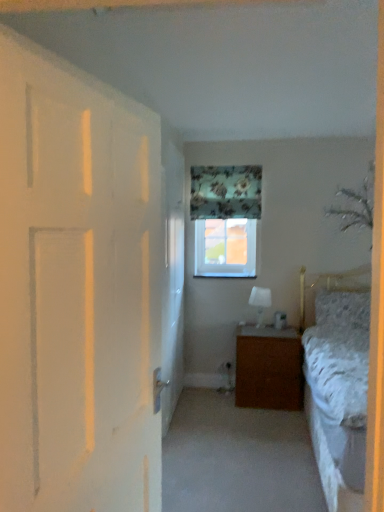
Measure the distance between floral fabric curtain at upper center and camera.

They are 3.98 meters apart.

Describe the element at coordinates (260, 302) in the screenshot. The image size is (384, 512). I see `white glossy lampshade at center` at that location.

What is the approximate width of white matte door at left?

white matte door at left is 5.54 inches in width.

What is the approximate height of white matte door at left?

The height of white matte door at left is 4.85 feet.

What is the approximate height of brown wooden nightstand at center?

It is 65.44 centimeters.

Where is `white glossy screen door at center`? white glossy screen door at center is located at coordinates coord(172,278).

At what (x,y) coordinates should I click in order to perform the action: click on fluffy white pillow at right. Please return your answer as a coordinate pair (x, y). Looking at the image, I should click on (343, 308).

Locate an element on the screen. Image resolution: width=384 pixels, height=512 pixels. floral fabric curtain at upper center is located at coordinates (225, 192).

In terms of width, does brown wooden nightstand at center look wider or thinner when compared to floral fabric curtain at upper center?

Considering their sizes, brown wooden nightstand at center looks broader than floral fabric curtain at upper center.

Is floral fabric curtain at upper center surrounded by brown wooden nightstand at center?

Definitely not — floral fabric curtain at upper center is not inside brown wooden nightstand at center.

How many degrees apart are the facing directions of brown wooden nightstand at center and floral fabric curtain at upper center?

The angular difference between brown wooden nightstand at center and floral fabric curtain at upper center is 0.752 degrees.

From the image's perspective, which is above, brown wooden nightstand at center or floral fabric curtain at upper center?

floral fabric curtain at upper center.

Considering the sizes of objects fluffy white pillow at right and white glossy lampshade at center in the image provided, who is thinner, fluffy white pillow at right or white glossy lampshade at center?

white glossy lampshade at center.

Between fluffy white pillow at right and white glossy lampshade at center, which one appears on the left side from the viewer's perspective?

white glossy lampshade at center.

This screenshot has width=384, height=512. What are the coordinates of `pillow on the right of white glossy lampshade at center` in the screenshot? It's located at (343, 308).

Is fluffy white pillow at right turned away from white glossy lampshade at center?

fluffy white pillow at right is not turned away from white glossy lampshade at center.

Is floral fabric curtain at upper center located within white glossy lampshade at center?

No, floral fabric curtain at upper center is not a part of white glossy lampshade at center.

In terms of size, does white glossy lampshade at center appear bigger or smaller than floral fabric curtain at upper center?

Considering their sizes, white glossy lampshade at center takes up less space than floral fabric curtain at upper center.

What's the angular difference between white glossy lampshade at center and floral fabric curtain at upper center's facing directions?

There is a 0.719-degree angle between the facing directions of white glossy lampshade at center and floral fabric curtain at upper center.

Is point (255, 302) farther from viewer compared to point (251, 190)?

No, (255, 302) is closer to viewer.

This screenshot has height=512, width=384. In the image, there is a clear glass window at upper center. In order to click on pillow below it (from a real-world perspective) in this screenshot , I will do `click(343, 308)`.

From the image's perspective, relative to clear glass window at upper center, is fluffy white pillow at right above or below?

fluffy white pillow at right is situated lower than clear glass window at upper center in the image.

Who is shorter, fluffy white pillow at right or clear glass window at upper center?

Standing shorter between the two is fluffy white pillow at right.

You are a GUI agent. You are given a task and a screenshot of the screen. Output one action in this format:
    pyautogui.click(x=<x>, y=<y>)
    Task: Click on the lamp behind the white matte door at left
    The height and width of the screenshot is (512, 384).
    Given the screenshot: What is the action you would take?
    pyautogui.click(x=260, y=302)

Considering the positions of objects white glossy lampshade at center and white matte door at left in the image provided, who is more to the left, white glossy lampshade at center or white matte door at left?

white matte door at left.

Is white glossy lampshade at center outside of white matte door at left?

Yes, white glossy lampshade at center is not within white matte door at left.

Is the position of white glossy lampshade at center more distant than that of white matte door at left?

That is True.

Considering the relative sizes of floral fabric curtain at upper center and fluffy white pillow at right in the image provided, is floral fabric curtain at upper center taller than fluffy white pillow at right?

Yes.

Which is more to the right, floral fabric curtain at upper center or fluffy white pillow at right?

fluffy white pillow at right is more to the right.

Is point (251, 178) positioned after point (336, 311)?

Yes.

Which is farther, (170,362) or (229,175)?

The point (229,175) is behind.

In terms of width, does white glossy screen door at center look wider or thinner when compared to floral fabric curtain at upper center?

Considering their sizes, white glossy screen door at center looks slimmer than floral fabric curtain at upper center.

Is floral fabric curtain at upper center inside white glossy screen door at center?

That's incorrect, floral fabric curtain at upper center is not inside white glossy screen door at center.

Identify the location of curtain behind the brown wooden nightstand at center. The height and width of the screenshot is (512, 384). (225, 192).

Locate an element on the screen. lamp below the fluffy white pillow at right (from a real-world perspective) is located at coordinates (260, 302).

Based on their spatial positions, is white matte door at left or white glossy screen door at center closer to brown wooden nightstand at center?

white glossy screen door at center lies closer to brown wooden nightstand at center than the other object.

Which object lies nearer to the anchor point fluffy white pillow at right, floral fabric curtain at upper center or clear glass window at upper center?

clear glass window at upper center lies closer to fluffy white pillow at right than the other object.

Considering their positions, is white glossy lampshade at center positioned further to white glossy screen door at center than clear glass window at upper center?

The object further to white glossy screen door at center is white glossy lampshade at center.

Based on their spatial positions, is white matte door at left or brown wooden nightstand at center further from floral fabric curtain at upper center?

white matte door at left is positioned further to the anchor floral fabric curtain at upper center.

Considering their positions, is white glossy lampshade at center positioned further to white matte door at left than fluffy white pillow at right?

The object further to white matte door at left is white glossy lampshade at center.

Considering their positions, is fluffy white pillow at right positioned closer to white matte door at left than white glossy screen door at center?

white glossy screen door at center.

Which object lies further to the anchor point white glossy lampshade at center, white matte door at left or clear glass window at upper center?

Among the two, white matte door at left is located further to white glossy lampshade at center.

Estimate the real-world distances between objects in this image. Which object is closer to fluffy white pillow at right, white matte door at left or floral fabric curtain at upper center?

The object closer to fluffy white pillow at right is floral fabric curtain at upper center.

This screenshot has height=512, width=384. What are the coordinates of `screen door between white matte door at left and clear glass window at upper center along the z-axis` in the screenshot? It's located at (172, 278).

Where is `window between white glossy screen door at center and fluffy white pillow at right`? The image size is (384, 512). window between white glossy screen door at center and fluffy white pillow at right is located at coordinates pos(225,248).

Where is `lamp between clear glass window at upper center and brown wooden nightstand at center from top to bottom`? This screenshot has width=384, height=512. lamp between clear glass window at upper center and brown wooden nightstand at center from top to bottom is located at coordinates (260, 302).

Identify the location of window between floral fabric curtain at upper center and brown wooden nightstand at center in the vertical direction. The width and height of the screenshot is (384, 512). (225, 248).